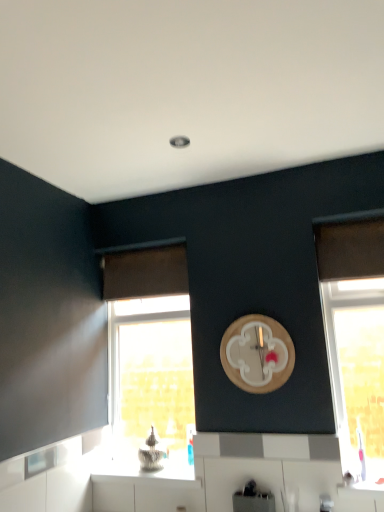
Question: Can you confirm if brown fabric curtain at upper left is wider than metallic silver toaster at lower center?

Choices:
 (A) no
 (B) yes

Answer: (A)

Question: Does brown fabric curtain at upper left lie behind metallic silver toaster at lower center?

Choices:
 (A) no
 (B) yes

Answer: (B)

Question: Can you confirm if brown fabric curtain at upper left is taller than metallic silver toaster at lower center?

Choices:
 (A) yes
 (B) no

Answer: (A)

Question: Is brown fabric curtain at upper left surrounding metallic silver toaster at lower center?

Choices:
 (A) no
 (B) yes

Answer: (A)

Question: From a real-world perspective, is brown fabric curtain at upper left located higher than metallic silver toaster at lower center?

Choices:
 (A) yes
 (B) no

Answer: (A)

Question: From the image's perspective, is brown fabric curtain at upper left above metallic silver toaster at lower center?

Choices:
 (A) no
 (B) yes

Answer: (B)

Question: Is white glossy countertop at lower center smaller than metallic silver toaster at lower center?

Choices:
 (A) yes
 (B) no

Answer: (B)

Question: Is white glossy countertop at lower center far away from metallic silver toaster at lower center?

Choices:
 (A) no
 (B) yes

Answer: (A)

Question: From the image's perspective, would you say white glossy countertop at lower center is positioned over metallic silver toaster at lower center?

Choices:
 (A) no
 (B) yes

Answer: (A)

Question: Considering the relative sizes of white glossy countertop at lower center and metallic silver toaster at lower center in the image provided, is white glossy countertop at lower center taller than metallic silver toaster at lower center?

Choices:
 (A) no
 (B) yes

Answer: (A)

Question: Can you confirm if white glossy countertop at lower center is wider than metallic silver toaster at lower center?

Choices:
 (A) yes
 (B) no

Answer: (A)

Question: Is white glossy countertop at lower center placed right next to metallic silver toaster at lower center?

Choices:
 (A) no
 (B) yes

Answer: (A)

Question: Considering the relative sizes of clear glass window at lower left, marked as the first window in a back-to-front arrangement, and metallic silver toaster at lower center in the image provided, is clear glass window at lower left, marked as the first window in a back-to-front arrangement, bigger than metallic silver toaster at lower center?

Choices:
 (A) yes
 (B) no

Answer: (A)